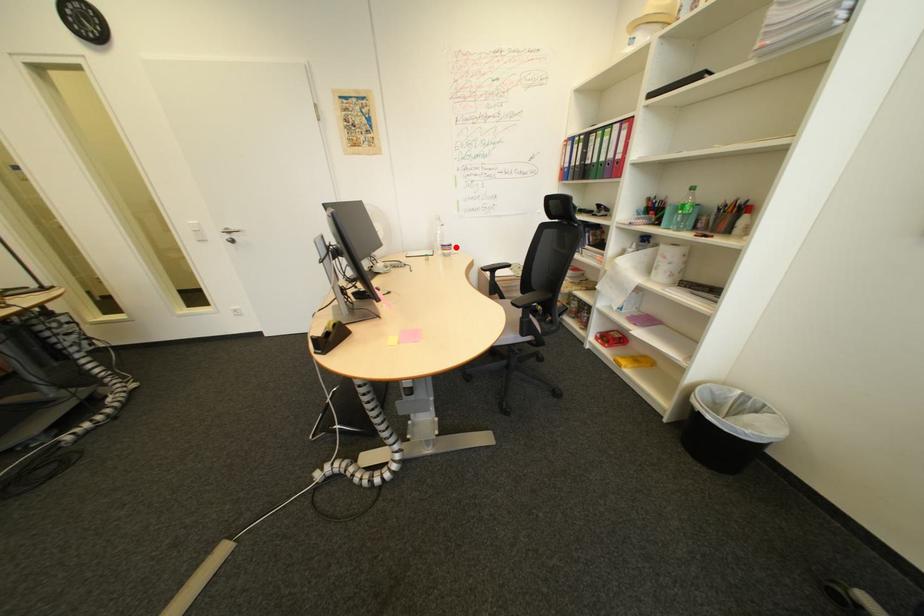
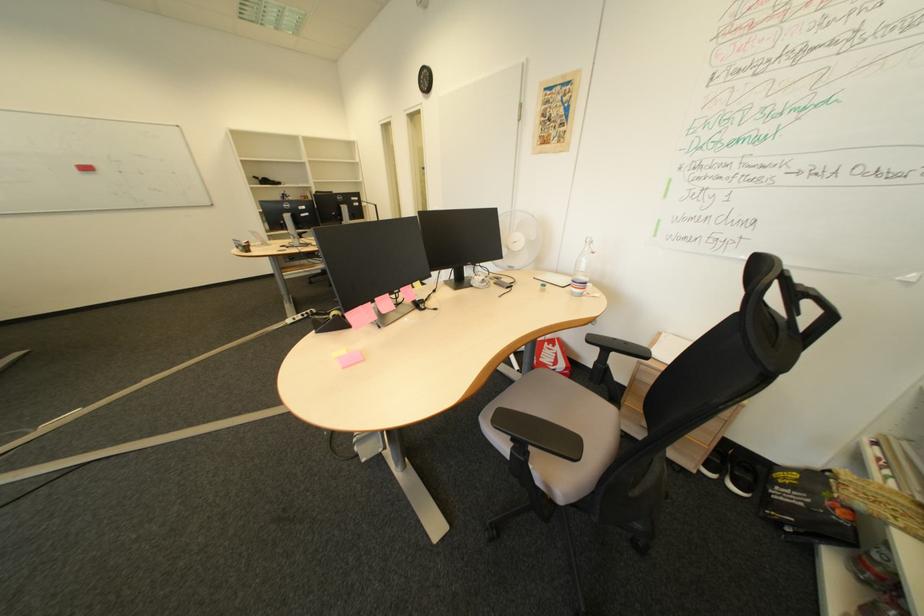
In the second image, find the point that corresponds to the highlighted location in the first image.

(587, 282)